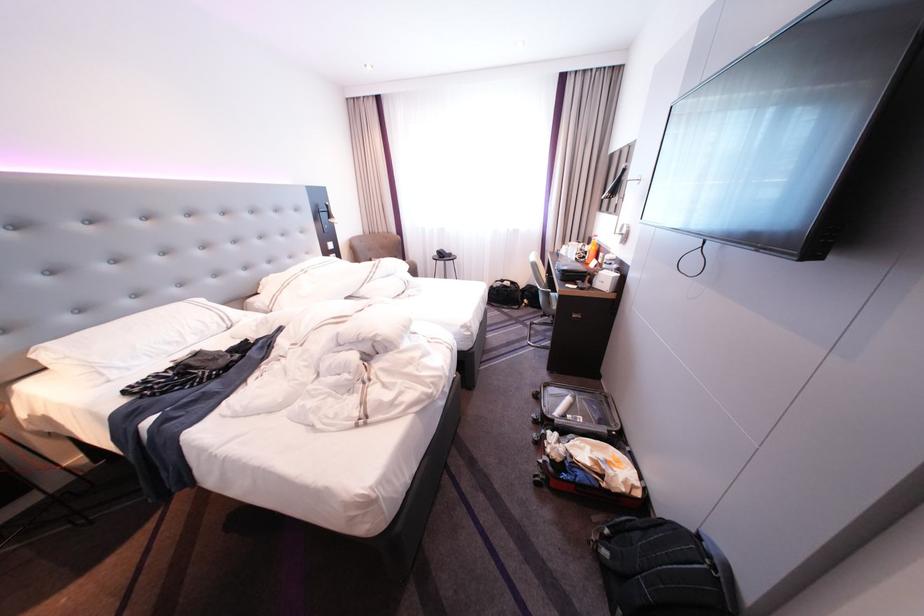
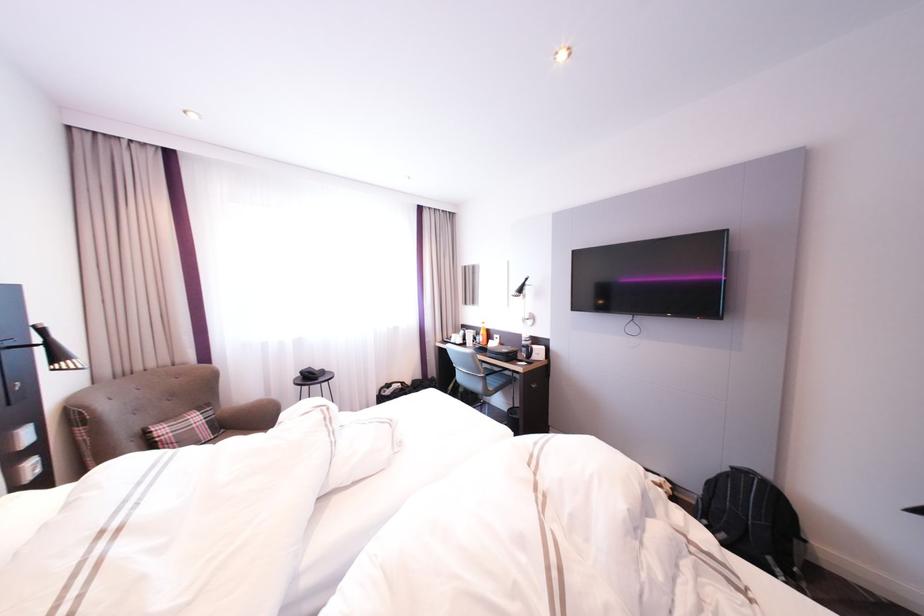
Where in the second image is the point corresponding to the point at 334,211 from the first image?

(18, 345)